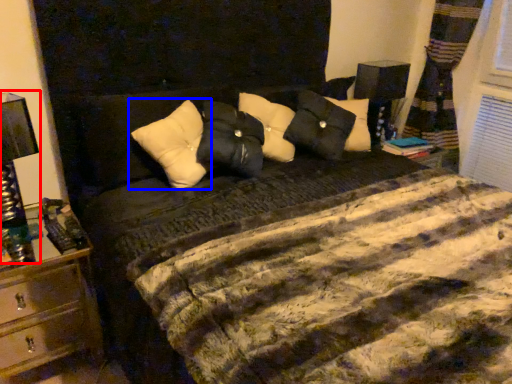
Question: Which point is further to the camera, bedside lamp (highlighted by a red box) or pillow (highlighted by a blue box)?

Choices:
 (A) bedside lamp
 (B) pillow

Answer: (B)